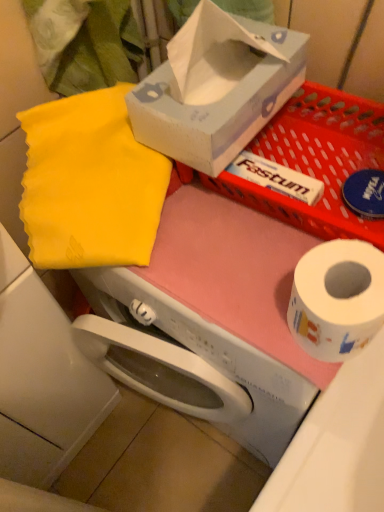
Question: Can you confirm if matte white tissue box at upper center is taller than white paper at right?

Choices:
 (A) no
 (B) yes

Answer: (B)

Question: Can you confirm if matte white tissue box at upper center is positioned to the left of white paper at right?

Choices:
 (A) yes
 (B) no

Answer: (A)

Question: From the image's perspective, would you say matte white tissue box at upper center is positioned over white paper at right?

Choices:
 (A) no
 (B) yes

Answer: (B)

Question: Is matte white tissue box at upper center wider than white paper at right?

Choices:
 (A) yes
 (B) no

Answer: (A)

Question: Is matte white tissue box at upper center at the right side of white paper at right?

Choices:
 (A) yes
 (B) no

Answer: (B)

Question: Is matte white tissue box at upper center wider or thinner than white paper at right?

Choices:
 (A) wide
 (B) thin

Answer: (A)

Question: Is matte white tissue box at upper center inside or outside of white paper at right?

Choices:
 (A) inside
 (B) outside

Answer: (B)

Question: Based on their sizes in the image, would you say matte white tissue box at upper center is bigger or smaller than white paper at right?

Choices:
 (A) small
 (B) big

Answer: (B)

Question: From a real-world perspective, is matte white tissue box at upper center positioned above or below white paper at right?

Choices:
 (A) above
 (B) below

Answer: (A)

Question: Is white paper at right situated inside yellow fabric at upper left or outside?

Choices:
 (A) outside
 (B) inside

Answer: (A)

Question: Looking at their shapes, would you say white paper at right is wider or thinner than yellow fabric at upper left?

Choices:
 (A) wide
 (B) thin

Answer: (B)

Question: Would you say white paper at right is to the left or to the right of yellow fabric at upper left in the picture?

Choices:
 (A) right
 (B) left

Answer: (A)

Question: From a real-world perspective, is white paper at right above or below yellow fabric at upper left?

Choices:
 (A) above
 (B) below

Answer: (A)

Question: Is point (97, 232) positioned closer to the camera than point (365, 276)?

Choices:
 (A) closer
 (B) farther

Answer: (B)

Question: Is yellow fabric at upper left bigger or smaller than white paper at right?

Choices:
 (A) big
 (B) small

Answer: (A)